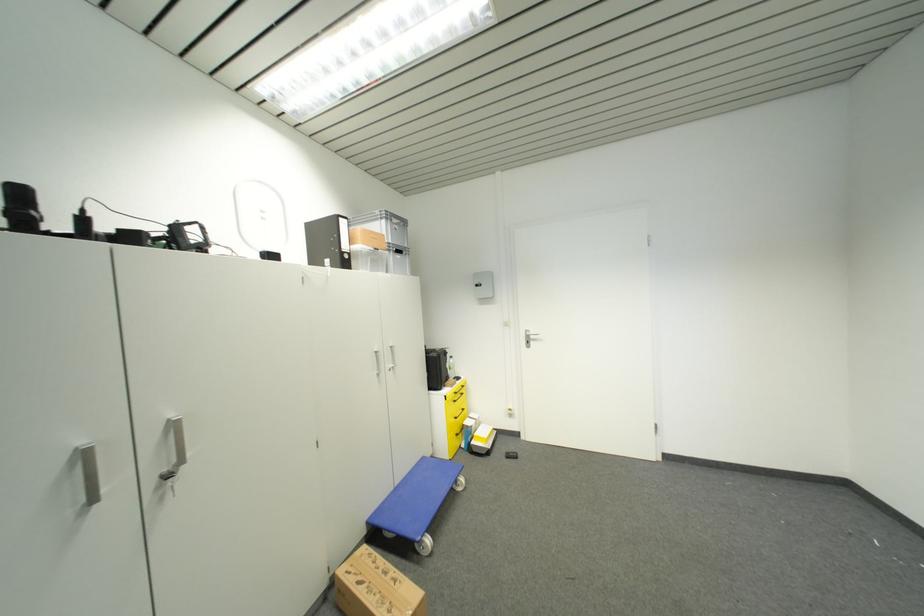
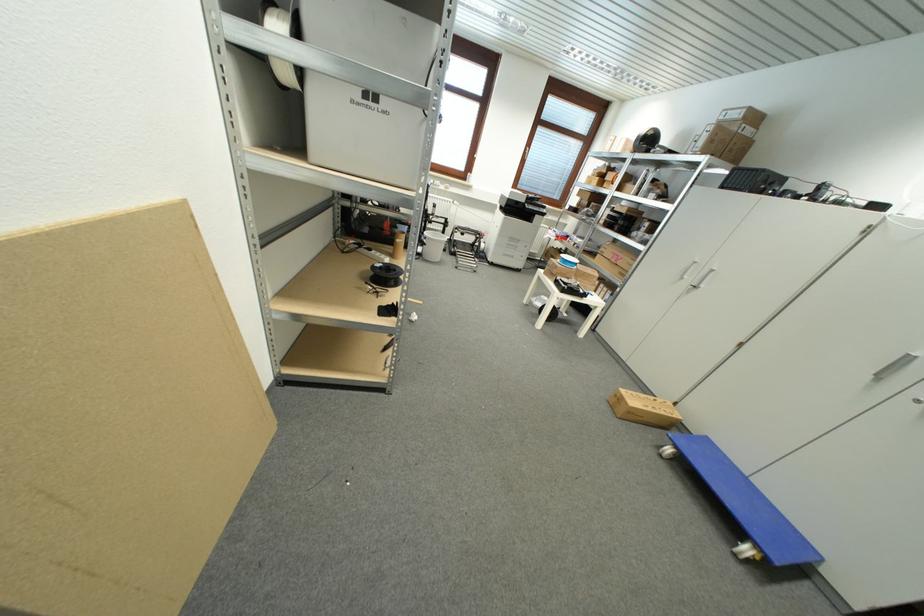
The point at (x=372, y=525) is marked in the first image. Where is the corresponding point in the second image?

(711, 440)